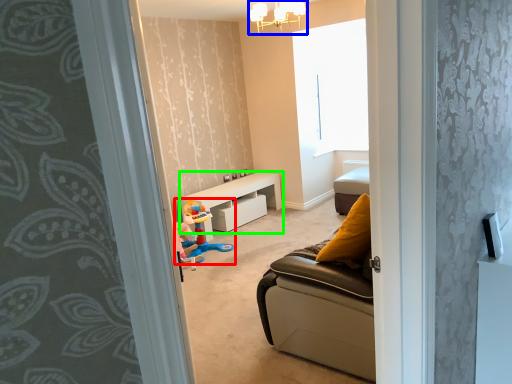
Question: Estimate the real-world distances between objects in this image. Which object is closer to toy (highlighted by a red box), light fixture (highlighted by a blue box) or table (highlighted by a green box)?

Choices:
 (A) light fixture
 (B) table

Answer: (B)